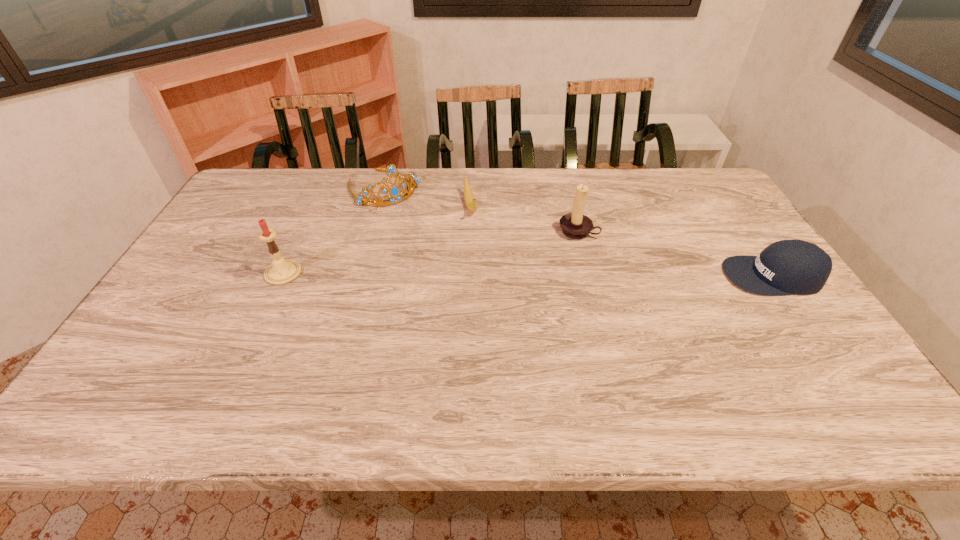
Find the location of a particular element. vacant region located 0.240m on the front-facing side of the tiara is located at coordinates (434, 244).

I want to click on banana located in the far edge section of the desktop, so click(470, 202).

Image resolution: width=960 pixels, height=540 pixels. In order to click on tiara that is at the far edge in this screenshot , I will do `click(394, 191)`.

The image size is (960, 540). In order to click on object positioned at the right edge in this screenshot , I will do `click(785, 267)`.

Identify the location of free space at the far edge of the desktop. (398, 179).

Where is `free space at the near edge`? free space at the near edge is located at coordinates (260, 369).

Find the location of a particular element. The width and height of the screenshot is (960, 540). vacant area at the left edge of the desktop is located at coordinates (164, 330).

Find the location of a particular element. vacant space at the far left corner of the desktop is located at coordinates (276, 167).

The image size is (960, 540). Find the location of `vacant area between the banana and the fourth object from right to left`. vacant area between the banana and the fourth object from right to left is located at coordinates [x=427, y=198].

Where is `unoccupied area between the third object from right to left and the baseball cap`? The image size is (960, 540). unoccupied area between the third object from right to left and the baseball cap is located at coordinates (622, 241).